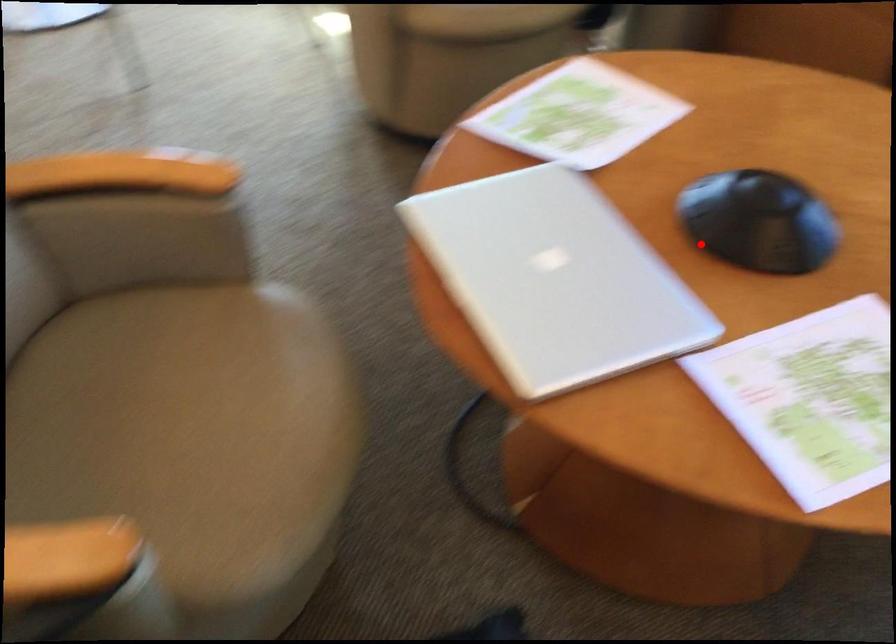
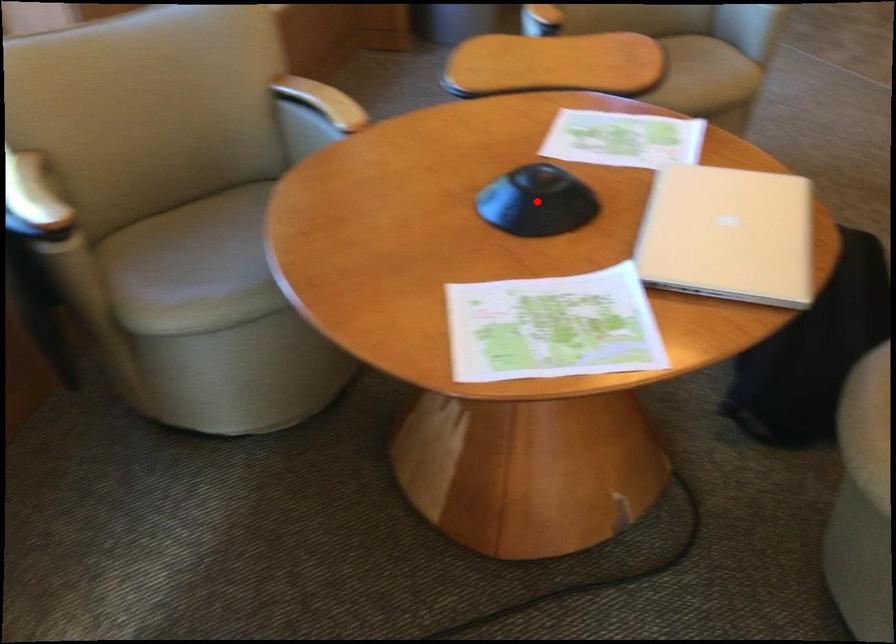
I am providing you with two images of the same scene from different viewpoints. A red point is marked on the first image and another point is marked on the second image. Is the red point in image1 aligned with the point shown in image2?

Yes